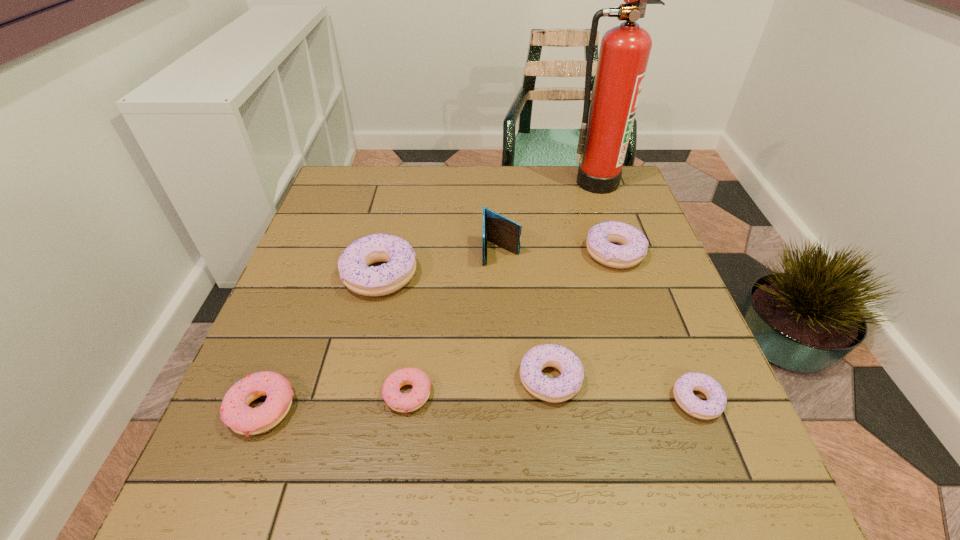
Where is `the tallest object`? the tallest object is located at coordinates (624, 52).

Image resolution: width=960 pixels, height=540 pixels. Identify the location of fire extinguisher. (624, 52).

I want to click on the second tallest object, so click(x=505, y=233).

Where is `blue wallet`? This screenshot has height=540, width=960. blue wallet is located at coordinates (505, 233).

Find the location of a particular element. The width and height of the screenshot is (960, 540). the tallest doughnut is located at coordinates (353, 265).

Where is `the biggest purple doughnut`? the biggest purple doughnut is located at coordinates (353, 265).

Where is `the second tallest doughnut`? the second tallest doughnut is located at coordinates (601, 237).

Identify the location of the second biggest purple doughnut. The width and height of the screenshot is (960, 540). (601, 237).

This screenshot has width=960, height=540. Identify the location of the third doughnut from right to left. (554, 390).

This screenshot has width=960, height=540. What are the coordinates of `the third biggest purple doughnut` in the screenshot? It's located at (554, 390).